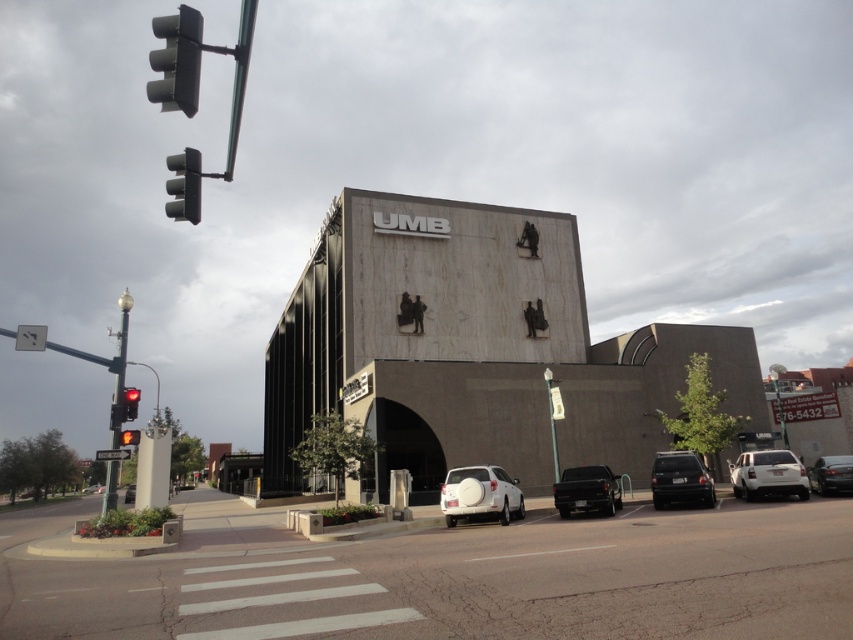
You are a delivery driver approaching the building with the UMB logo. You see a white matte suv at right and a metallic traffic light at upper left. Which object is positioned farther to the right side of the scene?

The white matte suv at right is positioned farther to the right side of the scene than the metallic traffic light at upper left.

You are a pedestrian standing at the corner of the street, looking towards the UMB building. You need to cross the street to reach the parking lot. Which vehicle should you avoid stepping on first as you walk towards the shiny black truck at center and the white matte sedan at lower left?

You should avoid stepping on the white matte sedan at lower left first because it is positioned to the left of the shiny black truck at center, so it will be encountered sooner as you approach from the corner.

You are standing at the entrance of the building and want to locate the shiny black truck at center. According to the coordinates provided, where should you look relative to the building?

The shiny black truck at center is located at coordinates 0.767 along the x axis and 0.689 along the y axis relative to the building.